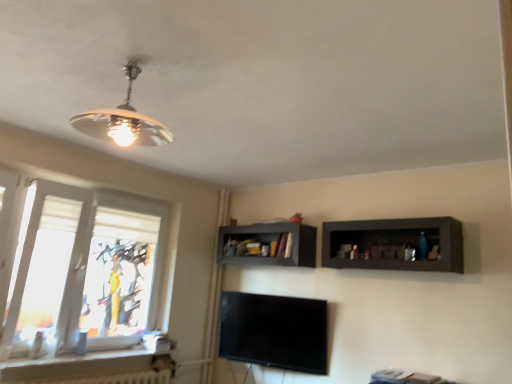
Question: Considering their positions, is dark wood shelf at right, the second shelf in the left-to-right sequence, located in front of or behind white textured radiator at lower left?

Choices:
 (A) behind
 (B) front

Answer: (A)

Question: Considering the relative positions of dark wood shelf at right, acting as the first shelf starting from the right, and white textured radiator at lower left in the image provided, is dark wood shelf at right, acting as the first shelf starting from the right, to the left or to the right of white textured radiator at lower left?

Choices:
 (A) left
 (B) right

Answer: (B)

Question: Estimate the real-world distances between objects in this image. Which object is closer to the white glossy window sill at lower left?

Choices:
 (A) white textured window at left
 (B) dark wood shelf at right, the second shelf in the left-to-right sequence
 (C) white textured radiator at lower left
 (D) matte gray shelf at center, which is the first shelf from back to front

Answer: (C)

Question: Which of these objects is positioned farthest from the white textured window at left?

Choices:
 (A) white textured radiator at lower left
 (B) matte gray shelf at center, which is the first shelf from back to front
 (C) white glossy window sill at lower left
 (D) dark wood shelf at right, acting as the first shelf starting from the right

Answer: (D)